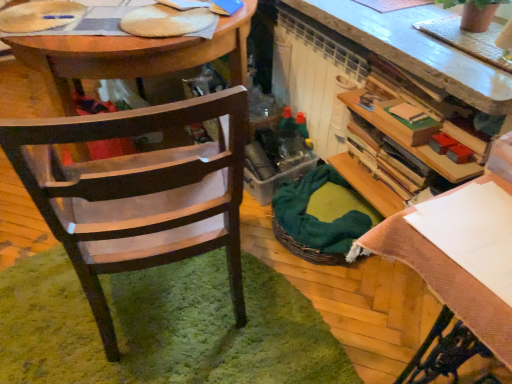
Question: Is white paper at upper right in contact with green woven picnic basket at center?

Choices:
 (A) yes
 (B) no

Answer: (B)

Question: From a real-world perspective, is white paper at upper right physically below green woven picnic basket at center?

Choices:
 (A) yes
 (B) no

Answer: (B)

Question: Can you confirm if white paper at upper right is bigger than green woven picnic basket at center?

Choices:
 (A) yes
 (B) no

Answer: (A)

Question: From a real-world perspective, does white paper at upper right stand above green woven picnic basket at center?

Choices:
 (A) yes
 (B) no

Answer: (A)

Question: Considering the relative sizes of white paper at upper right and green woven picnic basket at center in the image provided, is white paper at upper right wider than green woven picnic basket at center?

Choices:
 (A) no
 (B) yes

Answer: (B)

Question: Is white paper at upper right thinner than green woven picnic basket at center?

Choices:
 (A) yes
 (B) no

Answer: (B)

Question: Is wooden desk at center placed right next to wooden chair at left?

Choices:
 (A) no
 (B) yes

Answer: (A)

Question: Does wooden desk at center have a greater height compared to wooden chair at left?

Choices:
 (A) no
 (B) yes

Answer: (A)

Question: Is wooden desk at center facing towards wooden chair at left?

Choices:
 (A) yes
 (B) no

Answer: (B)

Question: Does wooden desk at center lie in front of wooden chair at left?

Choices:
 (A) yes
 (B) no

Answer: (B)

Question: Is wooden desk at center positioned far away from wooden chair at left?

Choices:
 (A) yes
 (B) no

Answer: (B)

Question: Considering the relative sizes of wooden desk at center and wooden chair at left in the image provided, is wooden desk at center wider than wooden chair at left?

Choices:
 (A) no
 (B) yes

Answer: (B)

Question: From the image's perspective, does green woven picnic basket at center appear lower than terracotta textured pot at upper right?

Choices:
 (A) no
 (B) yes

Answer: (B)